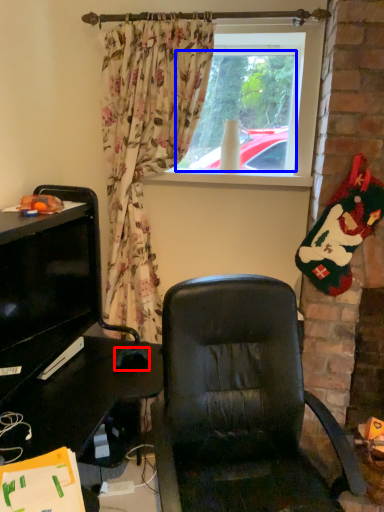
Question: Which of the following is the closest to the observer, mouse (highlighted by a red box) or window screen (highlighted by a blue box)?

Choices:
 (A) mouse
 (B) window screen

Answer: (A)